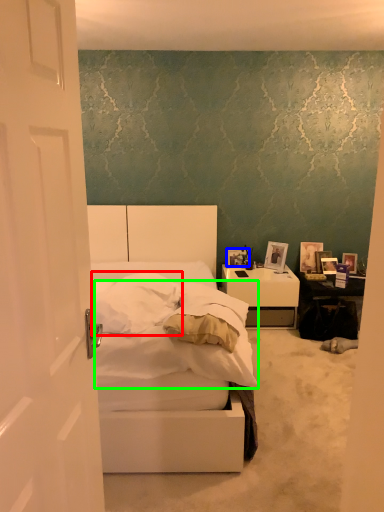
Question: Which is farther away from pillow (highlighted by a red box)? picture frame (highlighted by a blue box) or mattress (highlighted by a green box)?

Choices:
 (A) picture frame
 (B) mattress

Answer: (A)